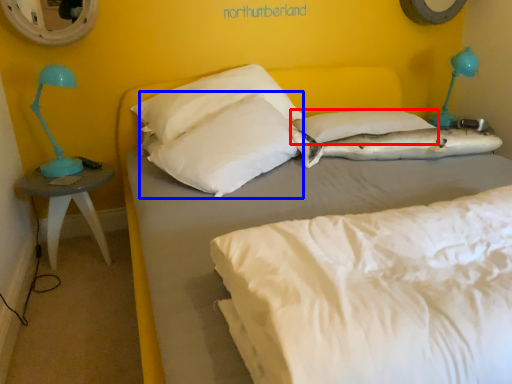
Question: Which point is closer to the camera, pillow (highlighted by a red box) or pillow (highlighted by a blue box)?

Choices:
 (A) pillow
 (B) pillow

Answer: (B)